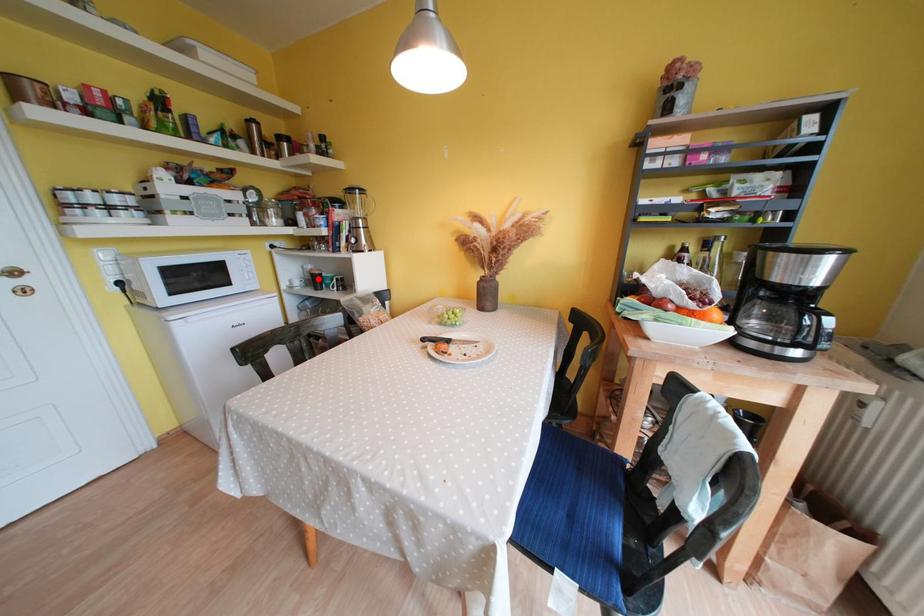
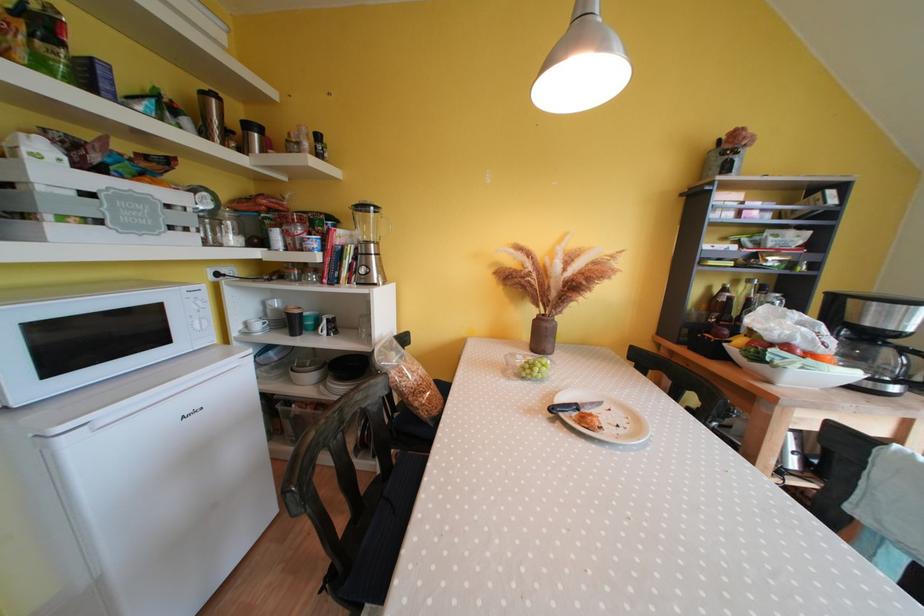
In the second image, find the point that corresponds to the highlighted location in the first image.

(296, 318)